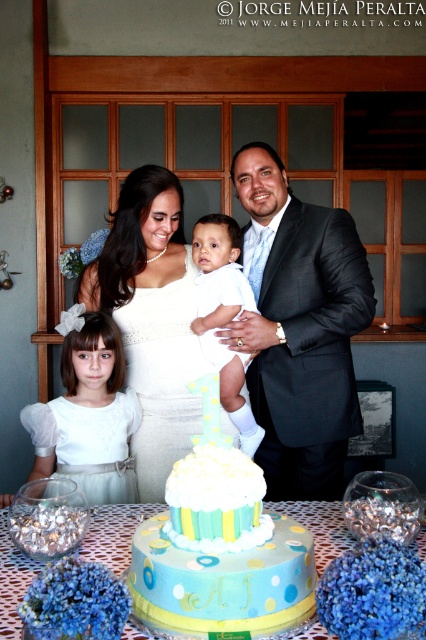
Is light blue fondant cake at center positioned at the back of blue polka dot cake at center?

No, it is not.

Who is positioned more to the left, light blue fondant cake at center or blue polka dot cake at center?

From the viewer's perspective, blue polka dot cake at center appears more on the left side.

Which is in front, point (206, 474) or point (16, 588)?

Point (206, 474) is more forward.

At what (x,y) coordinates should I click in order to perform the action: click on light blue fondant cake at center. Please return your answer as a coordinate pair (x, y). This screenshot has width=426, height=640. Looking at the image, I should click on (219, 545).

Between black suit at center and light blue fondant cake at center, which one is positioned higher?

black suit at center is above.

Is black suit at center taller than light blue fondant cake at center?

Correct, black suit at center is much taller as light blue fondant cake at center.

Locate an element on the screen. This screenshot has width=426, height=640. black suit at center is located at coordinates (299, 330).

How much distance is there between black suit at center and blue polka dot cake at center?

They are 30.49 inches apart.

Describe the element at coordinates (299, 330) in the screenshot. I see `black suit at center` at that location.

The height and width of the screenshot is (640, 426). Identify the location of black suit at center. (299, 330).